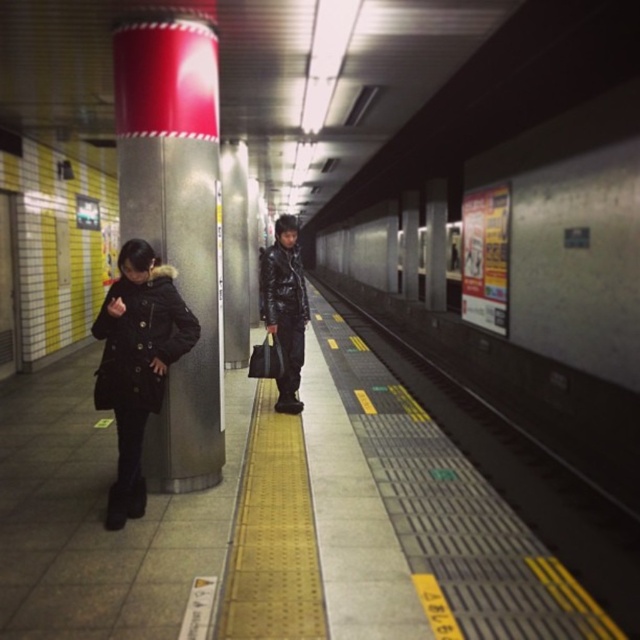
Between metallic silver pillar at left and shiny black jacket at center, which one appears on the right side from the viewer's perspective?

shiny black jacket at center

Who is more forward, (166, 68) or (275, 296)?

Point (166, 68)

Where is `metallic silver pillar at left`? Image resolution: width=640 pixels, height=640 pixels. metallic silver pillar at left is located at coordinates (177, 227).

Between point (584, 432) and point (163, 349), which one is positioned in front?

Point (163, 349) is more forward.

Is point (580, 156) farther from viewer compared to point (116, 289)?

Yes, it is behind point (116, 289).

Locate an element on the screen. The width and height of the screenshot is (640, 640). metallic silver train at center is located at coordinates (525, 227).

Who is more distant from viewer, (516, 241) or (193, 321)?

Point (516, 241)

Is metallic silver train at center to the left of black matte coat at left from the viewer's perspective?

In fact, metallic silver train at center is to the right of black matte coat at left.

Who is more forward, [573,102] or [124,481]?

Positioned in front is point [124,481].

You are a GUI agent. You are given a task and a screenshot of the screen. Output one action in this format:
    pyautogui.click(x=<x>, y=<y>)
    Task: Click on the metallic silver train at center
    
    Given the screenshot: What is the action you would take?
    pos(525,227)